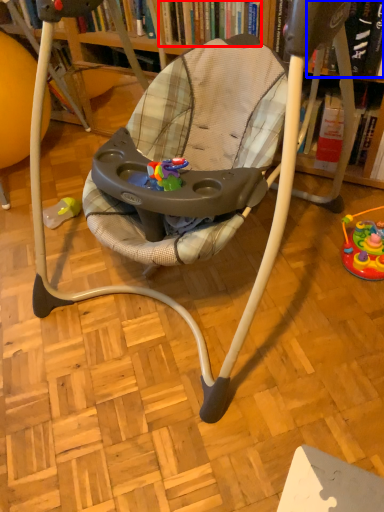
Question: Which object appears closest to the camera in this image, book (highlighted by a red box) or book (highlighted by a blue box)?

Choices:
 (A) book
 (B) book

Answer: (B)